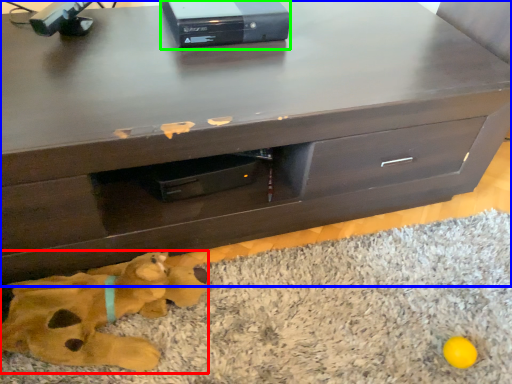
Question: Based on their relative distances, which object is farther from animal (highlighted by a red box)? Choose from chest of drawers (highlighted by a blue box) and equipment (highlighted by a green box).

Choices:
 (A) chest of drawers
 (B) equipment

Answer: (B)